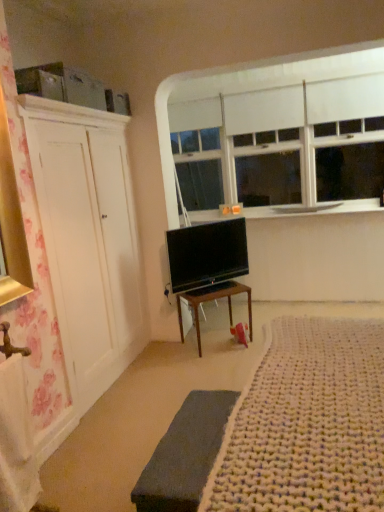
Identify the location of vacant space situated on the left part of wooden desk at center. (165, 355).